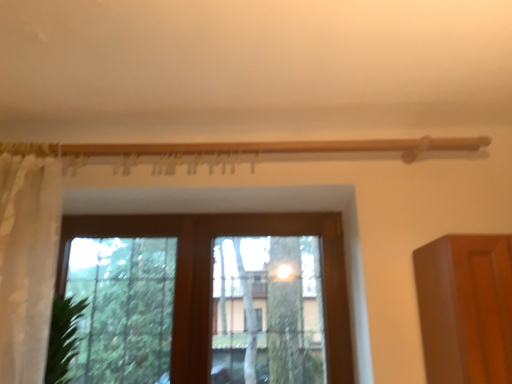
Question: Is point (179, 365) positioned closer to the camera than point (8, 317)?

Choices:
 (A) farther
 (B) closer

Answer: (A)

Question: Considering the positions of brown wooden window at center and white sheer curtain at left in the image, is brown wooden window at center wider or thinner than white sheer curtain at left?

Choices:
 (A) thin
 (B) wide

Answer: (A)

Question: From a real-world perspective, is brown wooden window at center physically located above or below white sheer curtain at left?

Choices:
 (A) above
 (B) below

Answer: (B)

Question: Considering the positions of white sheer curtain at left and brown wooden window at center in the image, is white sheer curtain at left wider or thinner than brown wooden window at center?

Choices:
 (A) wide
 (B) thin

Answer: (A)

Question: Considering the positions of white sheer curtain at left and brown wooden window at center in the image, is white sheer curtain at left taller or shorter than brown wooden window at center?

Choices:
 (A) tall
 (B) short

Answer: (A)

Question: From a real-world perspective, is white sheer curtain at left positioned above or below brown wooden window at center?

Choices:
 (A) above
 (B) below

Answer: (A)

Question: Is white sheer curtain at left to the left or to the right of brown wooden window at center in the image?

Choices:
 (A) right
 (B) left

Answer: (B)